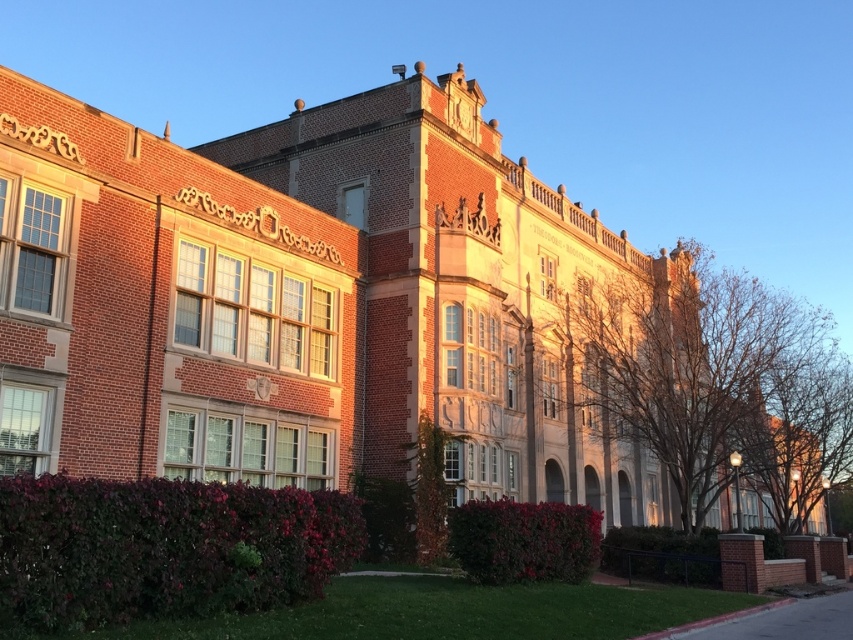
Can you confirm if dark green leafy hedge at lower center is thinner than green leafy hedge at lower center?

Yes.

Who is shorter, dark green leafy hedge at lower center or green leafy hedge at lower center?

Standing shorter between the two is green leafy hedge at lower center.

This screenshot has height=640, width=853. What are the coordinates of `dark green leafy hedge at lower center` in the screenshot? It's located at (524, 540).

Between point (120, 589) and point (558, 547), which one is positioned behind?

The point (558, 547) is behind.

At what (x,y) coordinates should I click in order to perform the action: click on dark green leafy hedge at lower left. Please return your answer as a coordinate pair (x, y). Looking at the image, I should click on (164, 548).

Image resolution: width=853 pixels, height=640 pixels. Find the location of `dark green leafy hedge at lower left`. dark green leafy hedge at lower left is located at coordinates (164, 548).

Is dark green leafy hedge at lower left shorter than green leafy hedge at lower center?

In fact, dark green leafy hedge at lower left may be taller than green leafy hedge at lower center.

Who is taller, dark green leafy hedge at lower left or green leafy hedge at lower center?

dark green leafy hedge at lower left is taller.

Image resolution: width=853 pixels, height=640 pixels. I want to click on dark green leafy hedge at lower left, so click(x=164, y=548).